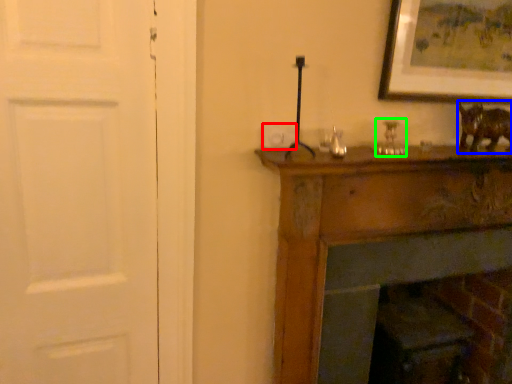
Question: Based on their relative distances, which object is farther from light switch (highlighted by a red box)? Choose from animal (highlighted by a blue box) and candle holder (highlighted by a green box).

Choices:
 (A) animal
 (B) candle holder

Answer: (A)